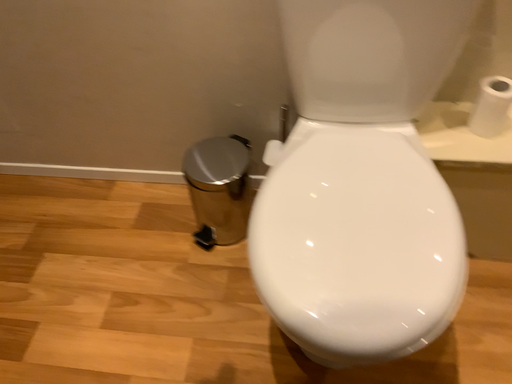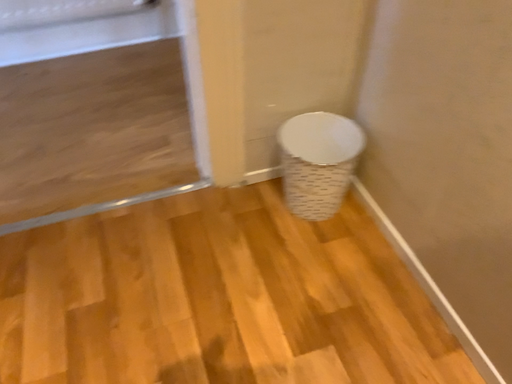
Question: Which way did the camera rotate in the video?

Choices:
 (A) rotated left
 (B) rotated right

Answer: (A)